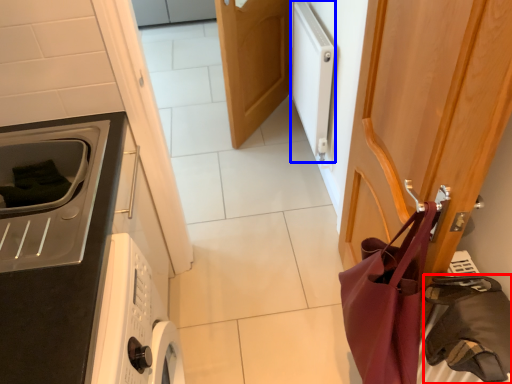
Question: Which of the following is the closest to the observer, bag (highlighted by a red box) or appliance (highlighted by a blue box)?

Choices:
 (A) bag
 (B) appliance

Answer: (A)